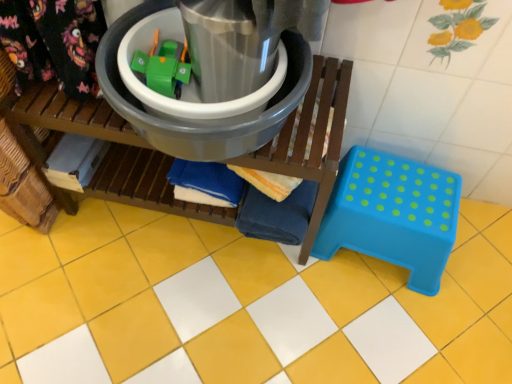
Locate an element on the screen. vacant point above yellow glossy tile at center (from a real-world perspective) is located at coordinates (230, 296).